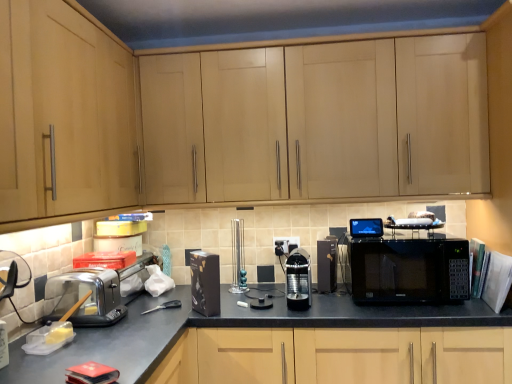
Locate an element on the screen. The height and width of the screenshot is (384, 512). unoccupied space behind metallic teal candlesticks at center, arranged as the 2th appliance when viewed from the left is located at coordinates (240, 285).